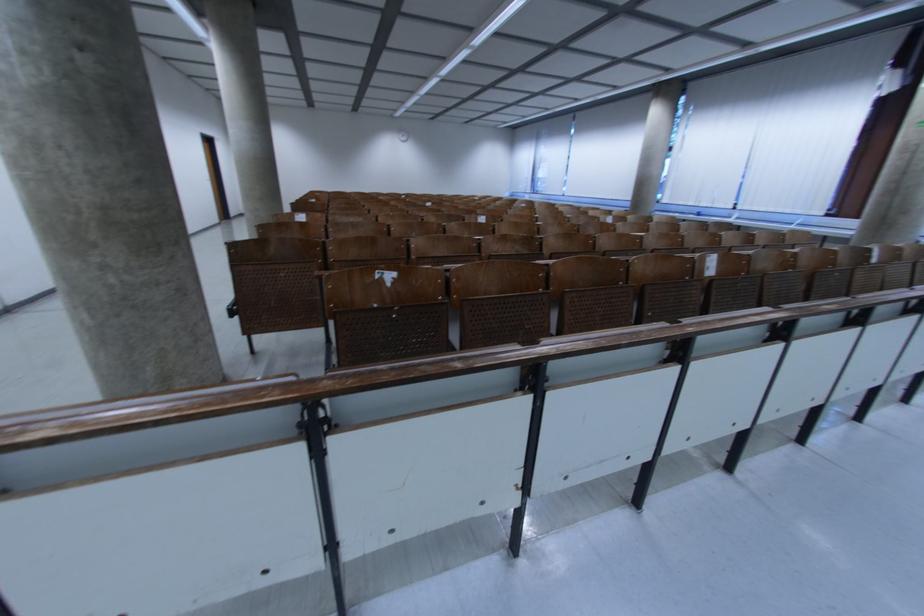
Locate an element on the screen. blue blind cord is located at coordinates (683, 128).